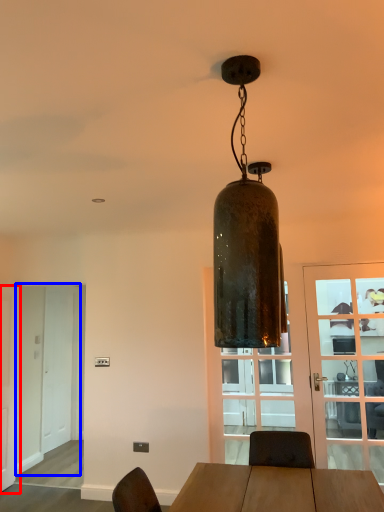
Question: Among these objects, which one is farthest to the camera, door (highlighted by a red box) or screen door (highlighted by a blue box)?

Choices:
 (A) door
 (B) screen door

Answer: (B)